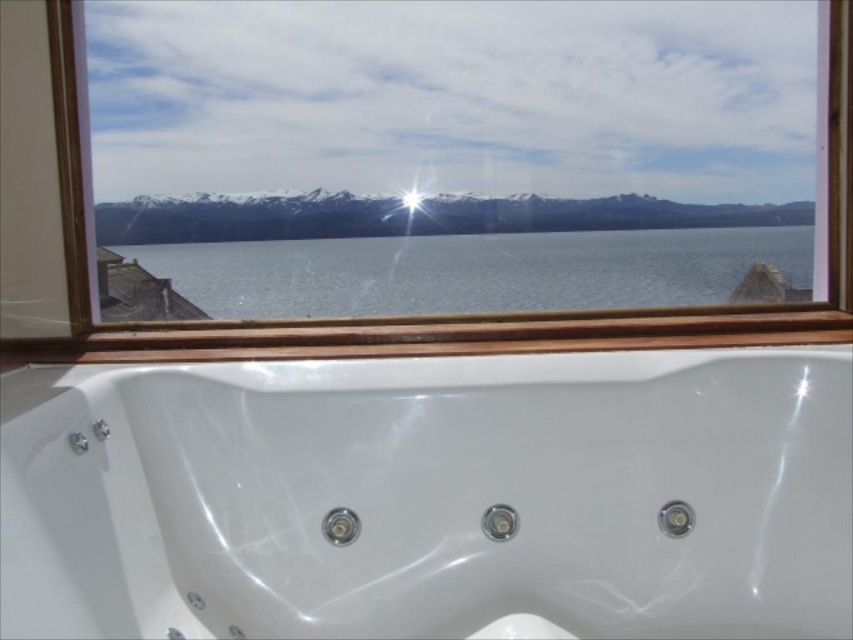
Question: Estimate the real-world distances between objects in this image. Which object is farther from the white glossy bathtub at center?

Choices:
 (A) clear water at center
 (B) snowy mountains at upper center

Answer: (B)

Question: Which point appears farthest from the camera in this image?

Choices:
 (A) click(624, 314)
 (B) click(672, 468)
 (C) click(149, 240)

Answer: (C)

Question: Can you confirm if white glossy bathtub at center is positioned to the right of clear water at center?

Choices:
 (A) yes
 (B) no

Answer: (B)

Question: Which object appears farthest from the camera in this image?

Choices:
 (A) snowy mountains at upper center
 (B) clear water at center
 (C) white glossy bathtub at center
 (D) wooden frame at upper center

Answer: (B)

Question: Does clear water at center appear under snowy mountains at upper center?

Choices:
 (A) yes
 (B) no

Answer: (A)

Question: Does white glossy bathtub at center appear on the right side of clear water at center?

Choices:
 (A) yes
 (B) no

Answer: (B)